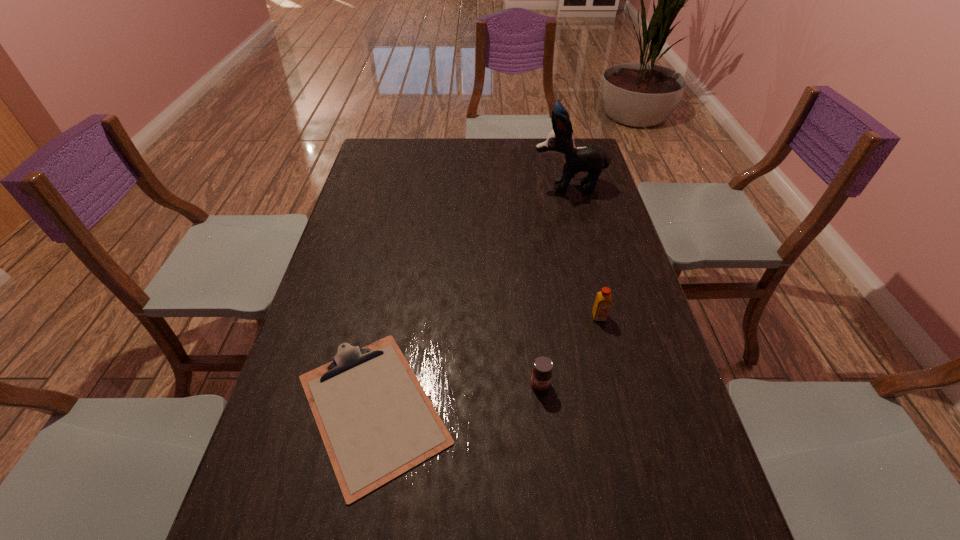
This screenshot has width=960, height=540. Find the location of `blank space located 0.070m on the front-facing side of the puppy`. blank space located 0.070m on the front-facing side of the puppy is located at coordinates (513, 185).

You are a GUI agent. You are given a task and a screenshot of the screen. Output one action in this format:
    pyautogui.click(x=<x>, y=<y>)
    Task: Click on the vacant space positioned 0.090m on the front and back of the third nearest object
    The width and height of the screenshot is (960, 540).
    Given the screenshot: What is the action you would take?
    pyautogui.click(x=608, y=350)

Where is `free space located on the label side of the third object from right to left`? free space located on the label side of the third object from right to left is located at coordinates (556, 530).

You are a GUI agent. You are given a task and a screenshot of the screen. Output one action in this format:
    pyautogui.click(x=<x>, y=<y>)
    Task: Click on the vacant space located on the front of the shortest object
    This screenshot has width=960, height=540.
    Given the screenshot: What is the action you would take?
    pyautogui.click(x=349, y=535)

Where is `object at the left edge`? The image size is (960, 540). object at the left edge is located at coordinates (376, 421).

Locate an element on the screen. The height and width of the screenshot is (540, 960). puppy that is positioned at the right edge is located at coordinates (590, 158).

You are a GUI agent. You are given a task and a screenshot of the screen. Output one action in this format:
    pyautogui.click(x=<x>, y=<y>)
    Task: Click on the orange juice present at the right edge
    This screenshot has width=960, height=540.
    Given the screenshot: What is the action you would take?
    pyautogui.click(x=603, y=300)

Identify the location of blank area at the far edge. (546, 159).

The image size is (960, 540). Find the location of `vacant space at the left edge`. vacant space at the left edge is located at coordinates (348, 293).

In the image, there is a desktop. Where is `free space at the right edge`? This screenshot has height=540, width=960. free space at the right edge is located at coordinates pos(658,411).